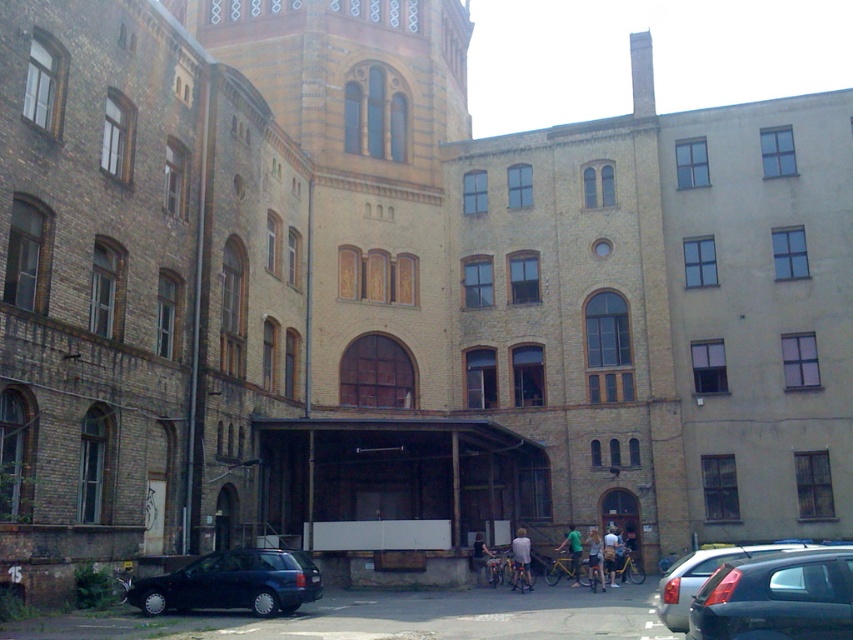
You are a delivery person trying to park your black matte car at lower right in a space that can only accommodate vehicles narrower than the light blue denim shorts at center. Can your car fit in the space?

The black matte car at lower right is wider than the light blue denim shorts at center, so it cannot fit in the space designed for narrower vehicles.

Looking at this image, you are standing in front of the building and notice two shirts hanging on a clothesline between two windows. The shirts are the light blue fabric shirt at center and the green fabric shirt at center. Which shirt is closer to the left side of the building?

The light blue fabric shirt at center is closer to the left side of the building because it is positioned to the left of the green fabric shirt at center.